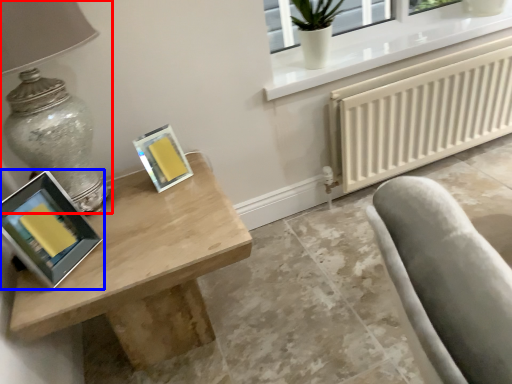
Question: Which object is further to the camera taking this photo, table lamp (highlighted by a red box) or picture frame (highlighted by a blue box)?

Choices:
 (A) table lamp
 (B) picture frame

Answer: (B)